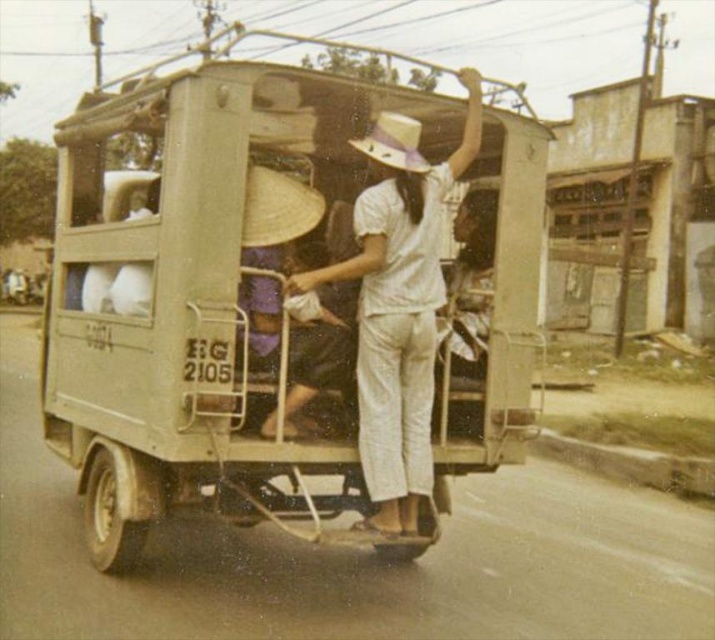
In the scene shown: Does matte beige truck at center have a lesser height compared to white cotton shirt at center?

In fact, matte beige truck at center may be taller than white cotton shirt at center.

What are the coordinates of `matte beige truck at center` in the screenshot? It's located at (287, 305).

Image resolution: width=715 pixels, height=640 pixels. I want to click on matte beige truck at center, so click(287, 305).

You are a GUI agent. You are given a task and a screenshot of the screen. Output one action in this format:
    pyautogui.click(x=<x>, y=<y>)
    Task: Click on the matte beige truck at center
    The image size is (715, 640).
    Given the screenshot: What is the action you would take?
    pyautogui.click(x=287, y=305)

Between matte beige truck at center and white straw hat at center, which one has less height?

white straw hat at center is shorter.

Who is taller, matte beige truck at center or white straw hat at center?

matte beige truck at center

Where is `matte beige truck at center`? The height and width of the screenshot is (640, 715). matte beige truck at center is located at coordinates pyautogui.click(x=287, y=305).

Who is shorter, white cotton shirt at center or natural straw hat at center?

Standing shorter between the two is natural straw hat at center.

Between white cotton shirt at center and natural straw hat at center, which one is positioned higher?

natural straw hat at center

Image resolution: width=715 pixels, height=640 pixels. In order to click on white cotton shirt at center in this screenshot , I will do `click(398, 307)`.